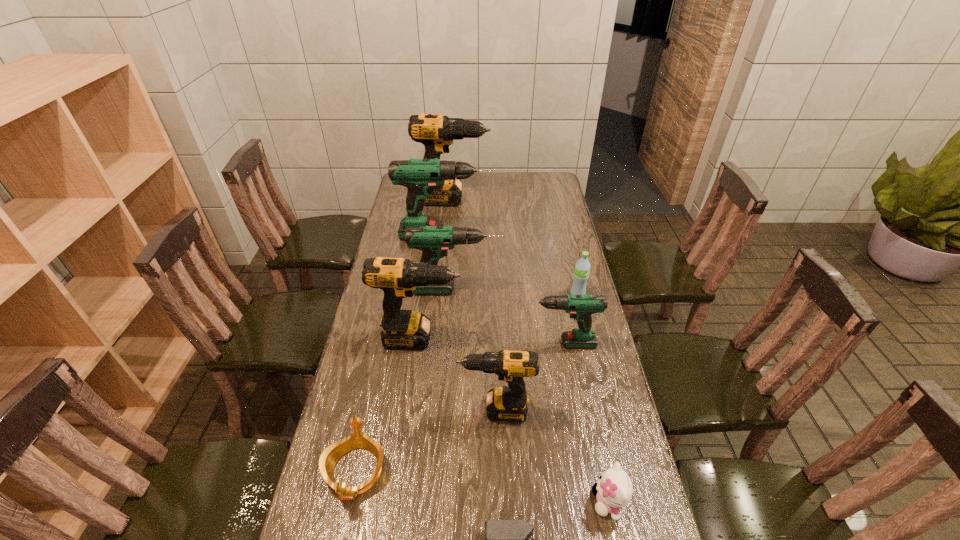
You are a GUI agent. You are given a task and a screenshot of the screen. Output one action in this format:
    pyautogui.click(x=<x>, y=<y>)
    Task: Click on the biggest black drill
    Image resolution: width=960 pixels, height=540 pixels.
    Given the screenshot: What is the action you would take?
    pyautogui.click(x=436, y=132)

I want to click on the farthest drill, so coord(436,132).

This screenshot has width=960, height=540. Find the location of `the second farthest drill`. the second farthest drill is located at coordinates (420, 176).

Locate an element on the screen. the ninth nearest object is located at coordinates (420, 176).

At what (x,y) coordinates should I click in order to perform the action: click on the second biggest black drill. Please return your answer as a coordinate pair (x, y). The image size is (960, 540). Looking at the image, I should click on (402, 329).

At what (x,y) coordinates should I click in order to perform the action: click on the second nearest green drill. Please return your answer as a coordinate pair (x, y). Looking at the image, I should click on tap(434, 241).

Where is `the third farthest drill`? the third farthest drill is located at coordinates [x=434, y=241].

Locate an element on the screen. the nearest drill is located at coordinates (508, 403).

At what (x,y) coordinates should I click in order to perform the action: click on the smallest black drill. Please return your answer as a coordinate pair (x, y). The height and width of the screenshot is (540, 960). Looking at the image, I should click on pos(508,403).

Locate an element on the screen. This screenshot has width=960, height=540. the rightmost green drill is located at coordinates (581, 307).